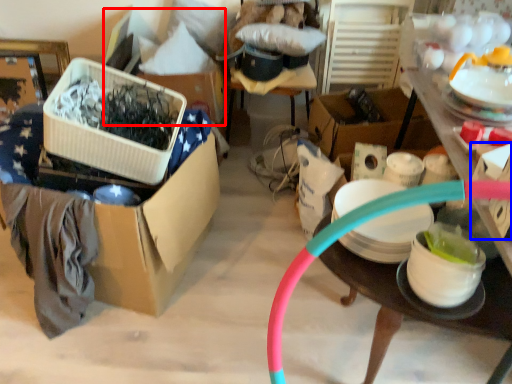
Question: Which point is closer to the camera, storage box (highlighted by a red box) or storage box (highlighted by a blue box)?

Choices:
 (A) storage box
 (B) storage box

Answer: (B)